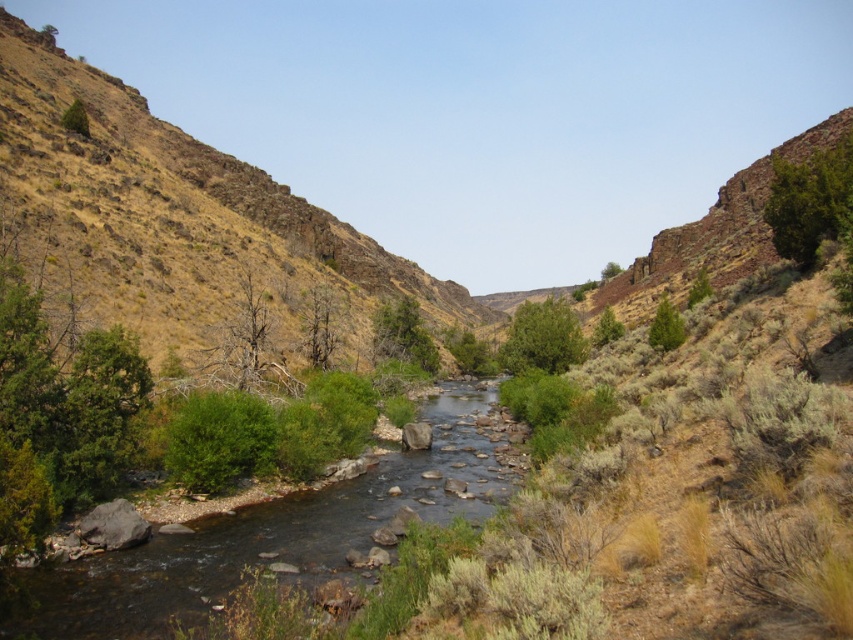
You are a hiker trying to cross the river. You see the brown rocky hillside at left and the green leafy bush at center. Which object is higher in elevation?

The brown rocky hillside at left is above the green leafy bush at center, so it is higher in elevation.

You are standing at the edge of the river and want to walk towards the green leafy shrub at upper left. However, there is a green leafy bush at center blocking your path. Can you walk around it to reach the shrub?

The green leafy bush at center is closer to the viewer than the green leafy shrub at upper left, so you can walk around it to reach the shrub.

You are standing at the origin point of the coordinate system in the image. The green grassy stream at center is at coordinate point 0.839, 0.312. If you want to walk towards the stream, which direction should you move in terms of the coordinate system?

To reach the green grassy stream at center located at coordinate point (x=265, y=536), you should move in the positive x and positive y directions within the coordinate system since both coordinates are greater than zero.